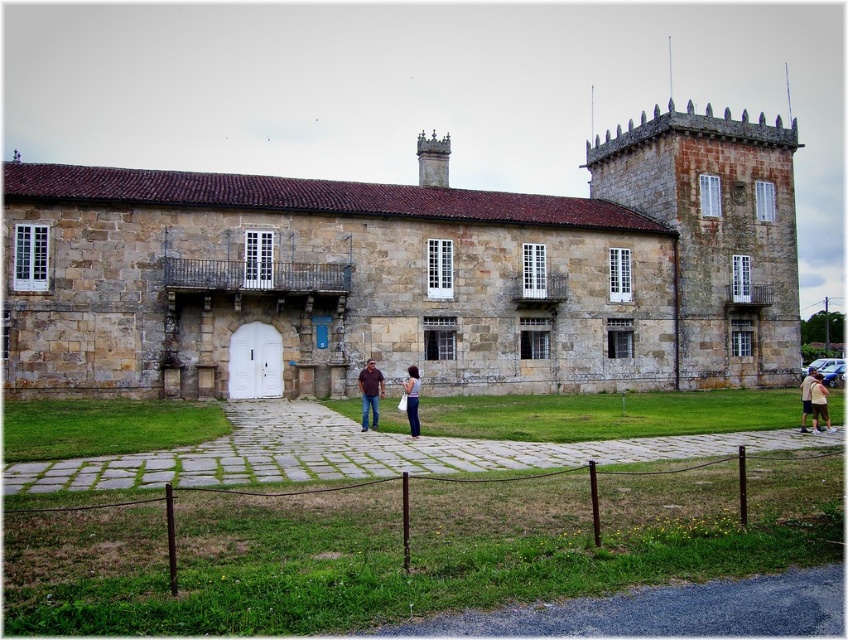
Question: Can you confirm if matte brown stone couple at center is thinner than brown leather jacket at center?

Choices:
 (A) yes
 (B) no

Answer: (B)

Question: Is tan cotton shirt at center positioned behind light brown shirt at center?

Choices:
 (A) yes
 (B) no

Answer: (B)

Question: Can you confirm if matte brown stone couple at center is positioned below brown leather jacket at center?

Choices:
 (A) no
 (B) yes

Answer: (B)

Question: Which object appears closest to the camera in this image?

Choices:
 (A) brown leather jacket at center
 (B) denim pants at center
 (C) matte brown stone couple at center

Answer: (C)

Question: Which point appears closest to the camera in this image?

Choices:
 (A) (414, 432)
 (B) (361, 422)

Answer: (A)

Question: Which object appears closest to the camera in this image?

Choices:
 (A) light brown shirt at center
 (B) brown leather jacket at center
 (C) denim pants at center

Answer: (C)